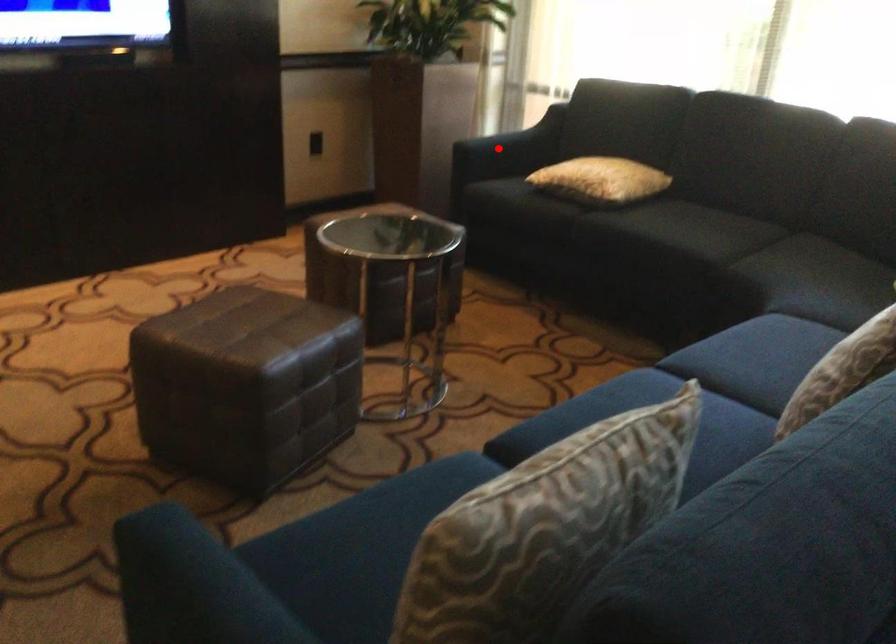
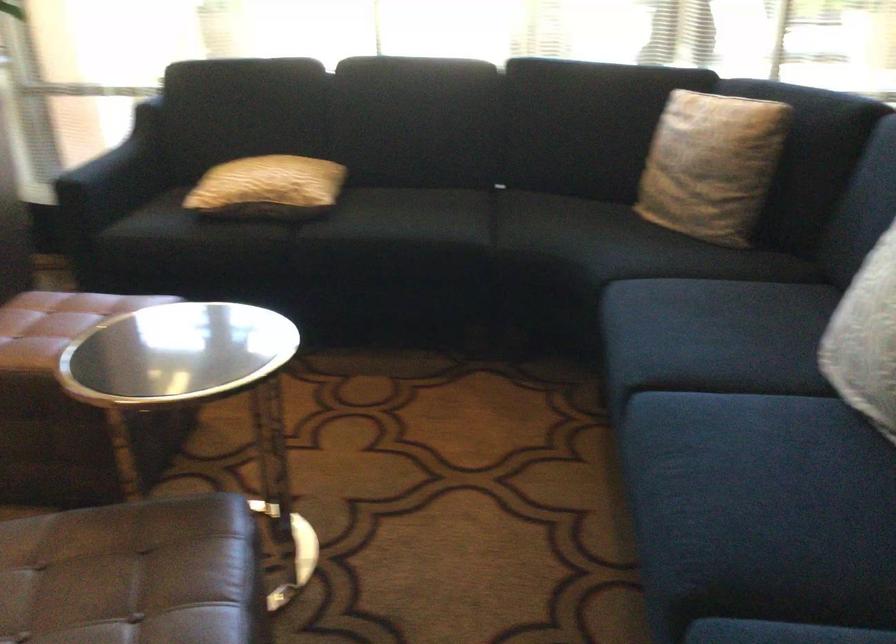
In the second image, find the point that corresponds to the highlighted location in the first image.

(115, 176)